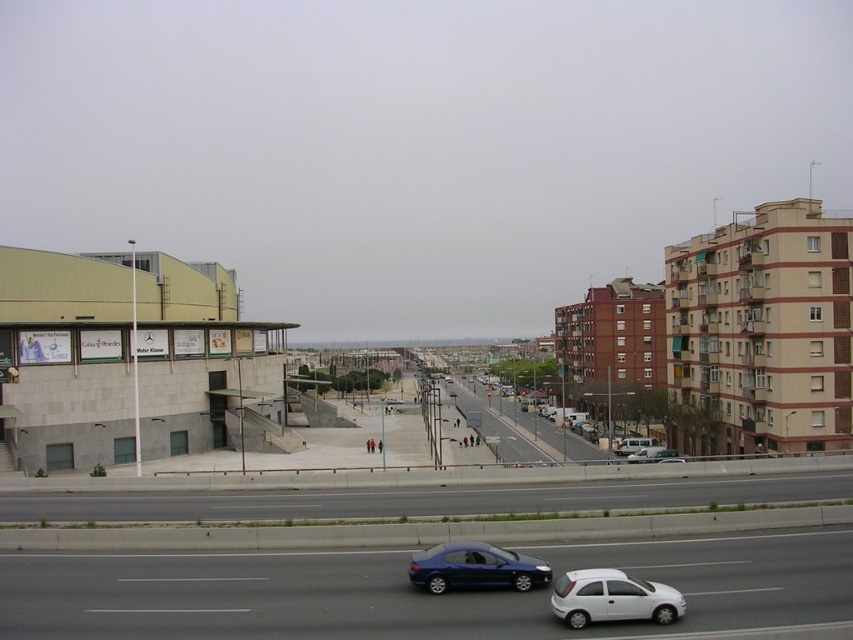
Is white glossy hatchback at lower center behind matte blue sedan at center?

No, it is not.

Does point (605, 611) come in front of point (480, 548)?

Yes.

Image resolution: width=853 pixels, height=640 pixels. I want to click on white glossy hatchback at lower center, so click(x=612, y=598).

Can you confirm if white glossy hatchback at lower center is positioned below white matte van at center?

No.

Which is below, white glossy hatchback at lower center or white matte van at center?

white matte van at center is lower down.

Where is `white glossy hatchback at lower center`? The image size is (853, 640). white glossy hatchback at lower center is located at coordinates (612, 598).

From the picture: Is asphalt road at lower center above white glossy hatchback at lower center?

Incorrect, asphalt road at lower center is not positioned above white glossy hatchback at lower center.

Can you confirm if asphalt road at lower center is positioned to the right of white glossy hatchback at lower center?

In fact, asphalt road at lower center is to the left of white glossy hatchback at lower center.

Which is in front, point (442, 496) or point (625, 582)?

Point (625, 582) is in front.

I want to click on asphalt road at lower center, so click(x=421, y=499).